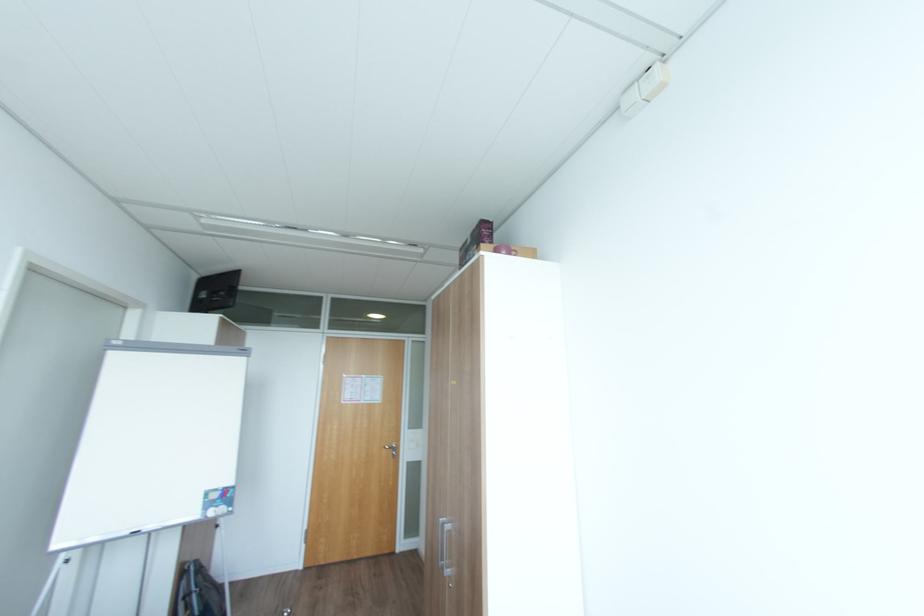
Where is `silver cabinet handle`? Image resolution: width=924 pixels, height=616 pixels. silver cabinet handle is located at coordinates (392, 448).